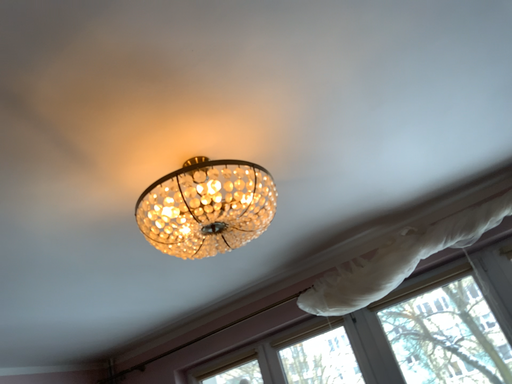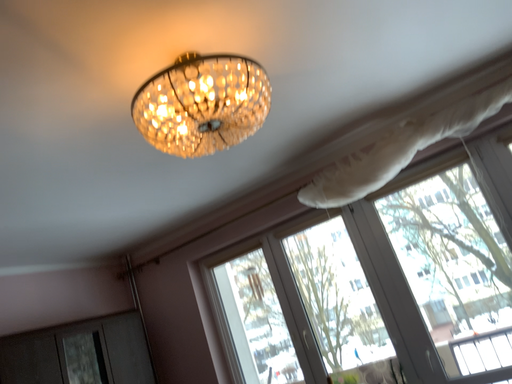
Question: Which way did the camera rotate in the video?

Choices:
 (A) rotated upward
 (B) rotated downward

Answer: (B)